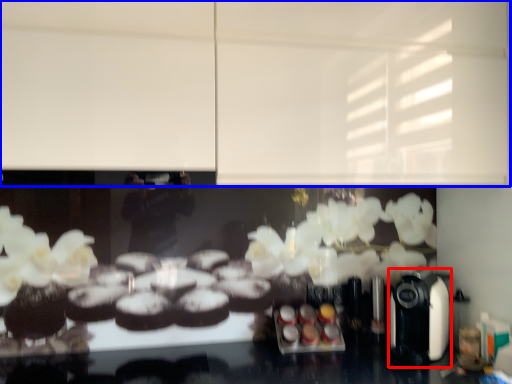
Question: Which object is closer to the camera taking this photo, coffee machine (highlighted by a red box) or backdrop (highlighted by a blue box)?

Choices:
 (A) coffee machine
 (B) backdrop

Answer: (B)